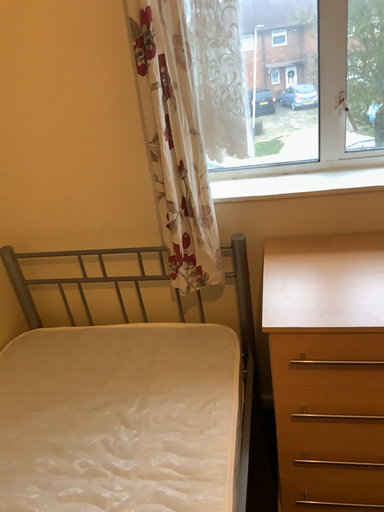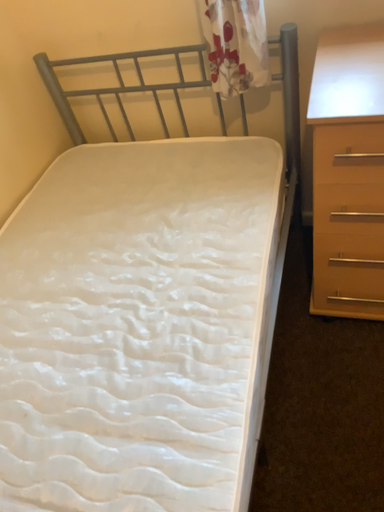
Question: Which way did the camera rotate in the video?

Choices:
 (A) rotated left
 (B) rotated right

Answer: (A)